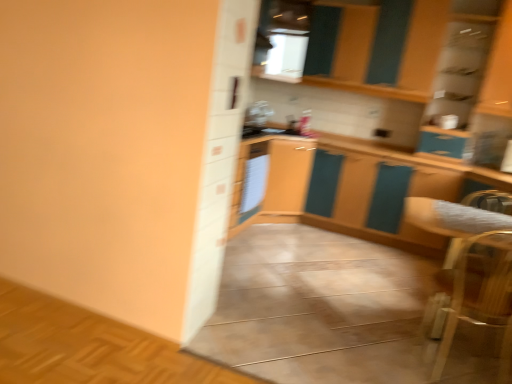
Question: Is white glossy refrigerator at center not inside wooden armchair at lower right?

Choices:
 (A) no
 (B) yes

Answer: (B)

Question: From a real-world perspective, is white glossy refrigerator at center located higher than wooden armchair at lower right?

Choices:
 (A) no
 (B) yes

Answer: (B)

Question: Is white glossy refrigerator at center next to wooden armchair at lower right?

Choices:
 (A) yes
 (B) no

Answer: (B)

Question: From a real-world perspective, is white glossy refrigerator at center under wooden armchair at lower right?

Choices:
 (A) yes
 (B) no

Answer: (B)

Question: Is white glossy refrigerator at center in front of wooden armchair at lower right?

Choices:
 (A) no
 (B) yes

Answer: (A)

Question: Can wooden armchair at lower right be found inside white glossy refrigerator at center?

Choices:
 (A) yes
 (B) no

Answer: (B)

Question: Is white glossy refrigerator at center located within wooden armchair at lower right?

Choices:
 (A) yes
 (B) no

Answer: (B)

Question: From a real-world perspective, is wooden armchair at lower right below white glossy refrigerator at center?

Choices:
 (A) yes
 (B) no

Answer: (A)

Question: Does wooden armchair at lower right appear on the right side of white glossy refrigerator at center?

Choices:
 (A) no
 (B) yes

Answer: (B)

Question: Considering the relative sizes of wooden armchair at lower right and white glossy refrigerator at center in the image provided, is wooden armchair at lower right smaller than white glossy refrigerator at center?

Choices:
 (A) yes
 (B) no

Answer: (B)

Question: Considering the relative sizes of wooden armchair at lower right and white glossy refrigerator at center in the image provided, is wooden armchair at lower right shorter than white glossy refrigerator at center?

Choices:
 (A) yes
 (B) no

Answer: (B)

Question: Does wooden armchair at lower right have a larger size compared to white glossy refrigerator at center?

Choices:
 (A) no
 (B) yes

Answer: (B)

Question: From a real-world perspective, relative to white glossy refrigerator at center, is wooden armchair at lower right vertically above or below?

Choices:
 (A) above
 (B) below

Answer: (B)